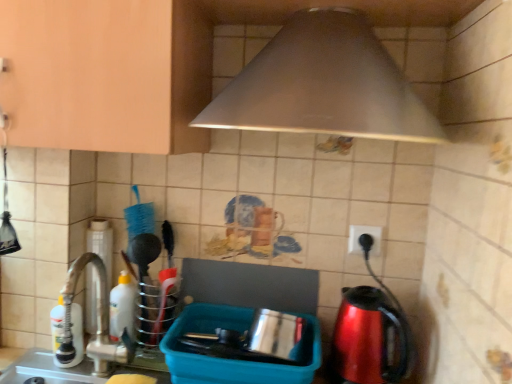
Measure the distance between point (54, 354) and camera.

The depth of point (54, 354) is 1.11 meters.

The image size is (512, 384). In order to click on satin nickel faucet at left in this screenshot , I will do `click(97, 316)`.

Where is `brushed metal faucet at left, which ranks as the second appliance in right-to-left order`? brushed metal faucet at left, which ranks as the second appliance in right-to-left order is located at coordinates (101, 243).

You are a GUI agent. You are given a task and a screenshot of the screen. Output one action in this format:
    pyautogui.click(x=<x>, y=<y>)
    Task: Click on the white plastic electric outlet at upper right
    The image size is (512, 384).
    Given the screenshot: What is the action you would take?
    pyautogui.click(x=360, y=235)

The image size is (512, 384). In order to click on shiny metallic kettle at right in this screenshot , I will do `click(368, 339)`.

What do you see at coordinates (368, 339) in the screenshot? I see `shiny metallic kettle at right` at bounding box center [368, 339].

Identify the location of metallic stainless steel pot at center, positioned as the 2th appliance in left-to-right order. (234, 359).

Does brushed metal faucet at left, marked as the 1th appliance in a left-to-right arrangement, have a larger size compared to white plastic electric outlet at upper right?

Yes.

Is brushed metal faucet at left, which ranks as the second appliance in right-to-left order, located outside white plastic electric outlet at upper right?

Yes.

What's the angular difference between brushed metal faucet at left, which ranks as the second appliance in right-to-left order, and white plastic electric outlet at upper right's facing directions?

There is a 0.352-degree angle between the facing directions of brushed metal faucet at left, which ranks as the second appliance in right-to-left order, and white plastic electric outlet at upper right.

From the image's perspective, would you say brushed metal faucet at left, which ranks as the second appliance in right-to-left order, is positioned over white plastic electric outlet at upper right?

No, from the image's perspective, brushed metal faucet at left, which ranks as the second appliance in right-to-left order, is not on top of white plastic electric outlet at upper right.

In the scene shown: Considering the sizes of objects white plastic electric outlet at upper right and satin nickel faucet at left in the image provided, who is wider, white plastic electric outlet at upper right or satin nickel faucet at left?

satin nickel faucet at left.

Which of these two, white plastic electric outlet at upper right or satin nickel faucet at left, stands taller?

satin nickel faucet at left is taller.

Based on their sizes in the image, would you say white plastic electric outlet at upper right is bigger or smaller than satin nickel faucet at left?

Clearly, white plastic electric outlet at upper right is smaller in size than satin nickel faucet at left.

From the image's perspective, which one is positioned higher, white plastic electric outlet at upper right or satin nickel faucet at left?

white plastic electric outlet at upper right.

Would you say white plastic electric outlet at upper right is a long distance from brushed metal faucet at left, marked as the 1th appliance in a left-to-right arrangement?

No.

Measure the distance between white plastic electric outlet at upper right and brushed metal faucet at left, which ranks as the second appliance in right-to-left order.

white plastic electric outlet at upper right is 27.14 inches away from brushed metal faucet at left, which ranks as the second appliance in right-to-left order.

Considering the positions of point (370, 233) and point (89, 314), is point (370, 233) closer or farther from the camera than point (89, 314)?

Point (370, 233) is positioned closer to the camera compared to point (89, 314).

In the scene shown: Is white plastic electric outlet at upper right in front of or behind brushed metal faucet at left, marked as the 1th appliance in a left-to-right arrangement, in the image?

white plastic electric outlet at upper right is in front of brushed metal faucet at left, marked as the 1th appliance in a left-to-right arrangement.

From a real-world perspective, which object rests below the other?

In real-world perspective, satin nickel faucet at left is lower.

How many degrees apart are the facing directions of satin nickel faucet at left and brushed metal faucet at left, marked as the 1th appliance in a left-to-right arrangement?

The angular difference between satin nickel faucet at left and brushed metal faucet at left, marked as the 1th appliance in a left-to-right arrangement, is 0.961 degrees.

Is point (69, 299) farther from viewer compared to point (95, 301)?

No, (69, 299) is closer to viewer.

Is satin nickel faucet at left thinner than metallic stainless steel pot at center, the 1th appliance viewed from the right?

Yes.

Can metallic stainless steel pot at center, the 1th appliance viewed from the right, be found inside satin nickel faucet at left?

No, metallic stainless steel pot at center, the 1th appliance viewed from the right, is not surrounded by satin nickel faucet at left.

Who is smaller, satin nickel faucet at left or metallic stainless steel pot at center, positioned as the 2th appliance in left-to-right order?

Smaller between the two is satin nickel faucet at left.

Who is shorter, metallic silver hood at upper center or satin nickel faucet at left?

metallic silver hood at upper center.

How much distance is there between metallic silver hood at upper center and satin nickel faucet at left?

metallic silver hood at upper center is 25.07 inches from satin nickel faucet at left.

From the image's perspective, who appears lower, metallic silver hood at upper center or satin nickel faucet at left?

satin nickel faucet at left, from the image's perspective.

Considering the relative positions of satin nickel faucet at left and white plastic bottle at left, the 1th bottle in the back-to-front sequence, in the image provided, is satin nickel faucet at left to the right of white plastic bottle at left, the 1th bottle in the back-to-front sequence, from the viewer's perspective?

No.

From a real-world perspective, between satin nickel faucet at left and white plastic bottle at left, the 1th bottle in the back-to-front sequence, who is vertically lower?

white plastic bottle at left, the 1th bottle in the back-to-front sequence, is physically lower.

Looking at their sizes, would you say satin nickel faucet at left is wider or thinner than white plastic bottle at left, which appears as the first bottle when viewed from the right?

satin nickel faucet at left is wider than white plastic bottle at left, which appears as the first bottle when viewed from the right.

You are a GUI agent. You are given a task and a screenshot of the screen. Output one action in this format:
    pyautogui.click(x=<x>, y=<y>)
    Task: Click on the sink located on the left of white plastic bottle at left, the 2th bottle from the front
    The width and height of the screenshot is (512, 384).
    Given the screenshot: What is the action you would take?
    pyautogui.click(x=97, y=316)

Find the location of a particular element. appliance that is the 2nd object to the left of the white plastic electric outlet at upper right, starting at the anchor is located at coordinates (101, 243).

Locate an element on the screen. This screenshot has height=384, width=512. sink lying in front of the white plastic electric outlet at upper right is located at coordinates (97, 316).

When comparing their distances from white glossy bottle at left, which appears as the 2th bottle when viewed from the back, does shiny metallic kettle at right or white plastic bottle at left, the 1th bottle in the back-to-front sequence, seem further?

shiny metallic kettle at right.

Which object lies further to the anchor point white glossy bottle at left, placed as the 1th bottle when sorted from left to right, metallic stainless steel pot at center, positioned as the 2th appliance in left-to-right order, or shiny metallic kettle at right?

shiny metallic kettle at right is further to white glossy bottle at left, placed as the 1th bottle when sorted from left to right.

Considering their positions, is metallic stainless steel pot at center, the 1th appliance viewed from the right, positioned further to white glossy bottle at left, acting as the second bottle starting from the right, than metallic silver hood at upper center?

metallic silver hood at upper center is further to white glossy bottle at left, acting as the second bottle starting from the right.

From the image, which object appears to be farther from white plastic electric outlet at upper right, metallic stainless steel pot at center, positioned as the 2th appliance in left-to-right order, or white plastic bottle at left, the second bottle in the left-to-right sequence?

Based on the image, white plastic bottle at left, the second bottle in the left-to-right sequence, appears to be further to white plastic electric outlet at upper right.

Based on their spatial positions, is shiny metallic kettle at right or white plastic electric outlet at upper right further from brushed metal faucet at left, which ranks as the second appliance in right-to-left order?

shiny metallic kettle at right is positioned further to the anchor brushed metal faucet at left, which ranks as the second appliance in right-to-left order.

From the image, which object appears to be nearer to brushed metal faucet at left, marked as the 1th appliance in a left-to-right arrangement, white plastic electric outlet at upper right or white glossy bottle at left, acting as the second bottle starting from the right?

Among the two, white glossy bottle at left, acting as the second bottle starting from the right, is located nearer to brushed metal faucet at left, marked as the 1th appliance in a left-to-right arrangement.

Consider the image. From the image, which object appears to be nearer to white plastic bottle at left, which appears as the first bottle when viewed from the right, brushed metal faucet at left, marked as the 1th appliance in a left-to-right arrangement, or white glossy bottle at left, which appears as the 2th bottle when viewed from the back?

brushed metal faucet at left, marked as the 1th appliance in a left-to-right arrangement.

Considering their positions, is white plastic electric outlet at upper right positioned closer to white glossy bottle at left, acting as the second bottle starting from the right, than shiny metallic kettle at right?

shiny metallic kettle at right is closer to white glossy bottle at left, acting as the second bottle starting from the right.

I want to click on sink between white glossy bottle at left, which appears as the 2th bottle when viewed from the back, and white plastic electric outlet at upper right, in the horizontal direction, so click(x=97, y=316).

Image resolution: width=512 pixels, height=384 pixels. I want to click on appliance between satin nickel faucet at left and shiny metallic kettle at right, so click(x=234, y=359).

Locate an element on the screen. This screenshot has width=512, height=384. appliance situated between white glossy bottle at left, marked as the 1th bottle in a front-to-back arrangement, and metallic stainless steel pot at center, positioned as the 2th appliance in left-to-right order, from left to right is located at coordinates (101, 243).

The width and height of the screenshot is (512, 384). Find the location of `kitchen appliance between white plastic bottle at left, the 1th bottle in the back-to-front sequence, and white plastic electric outlet at upper right, in the horizontal direction`. kitchen appliance between white plastic bottle at left, the 1th bottle in the back-to-front sequence, and white plastic electric outlet at upper right, in the horizontal direction is located at coordinates (324, 85).